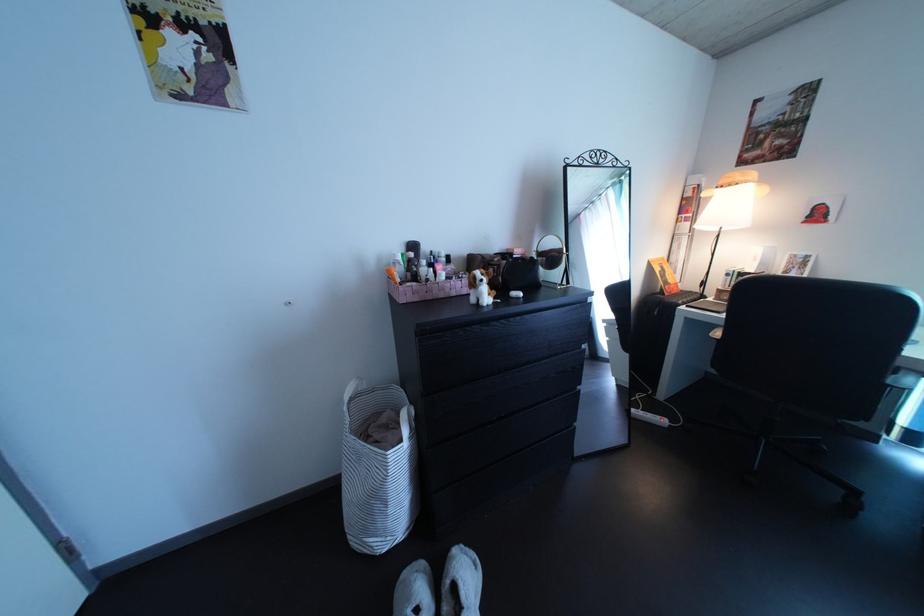
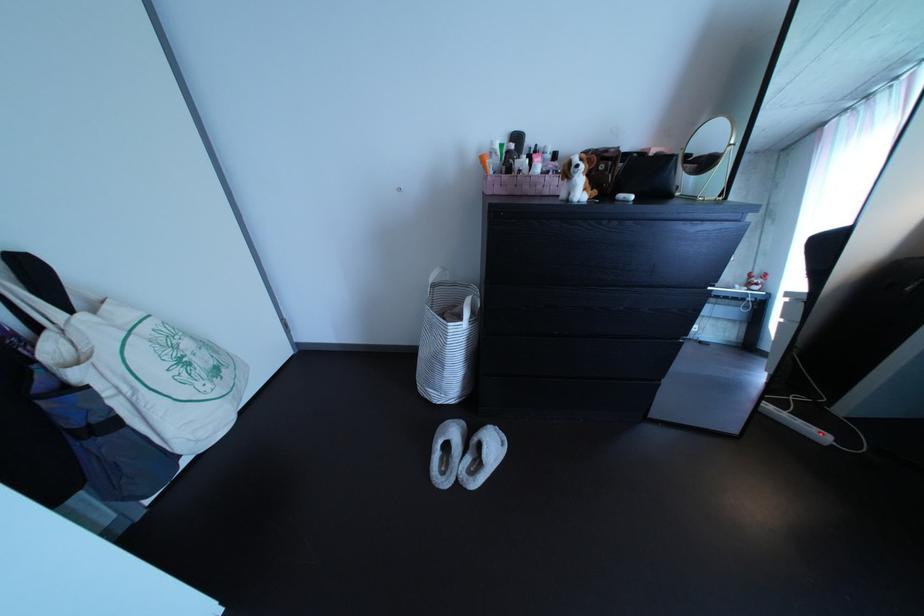
Question: The camera is either moving clockwise (left) or counter-clockwise (right) around the object. The first image is from the beginning of the video and the second image is from the end. Is the camera moving left or right when shooting the video?

Choices:
 (A) Left
 (B) Right

Answer: (B)